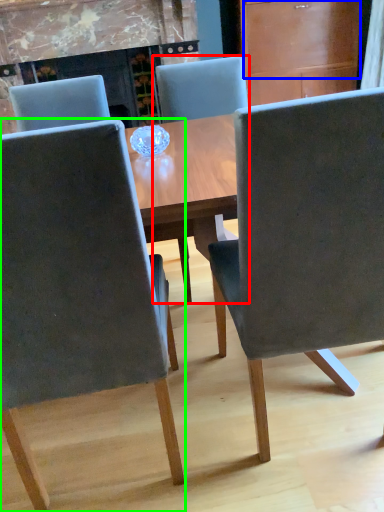
Question: Which is nearer to the chair (highlighted by a red box)? drawer (highlighted by a blue box) or chair (highlighted by a green box).

Choices:
 (A) drawer
 (B) chair

Answer: (B)